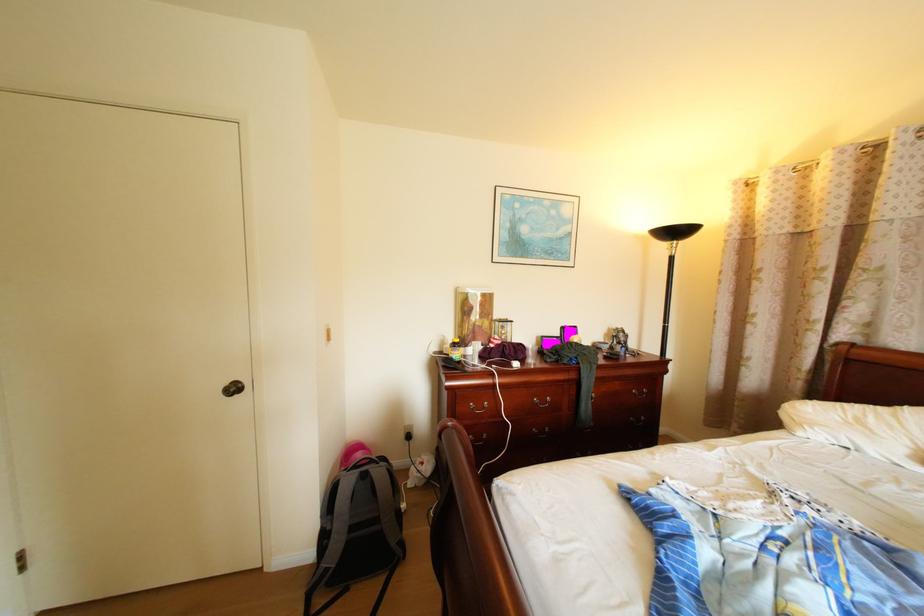
Where would you lift the grey backpack? Please return your answer as a coordinate pair (x, y).

(358, 532)